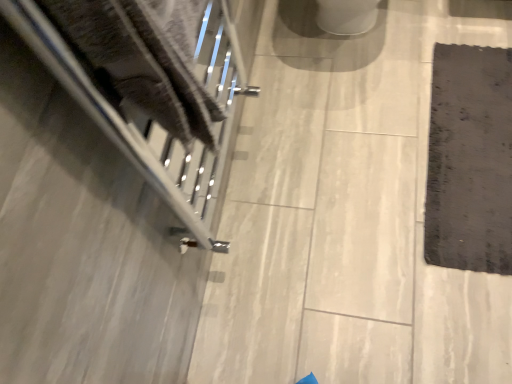
Image resolution: width=512 pixels, height=384 pixels. What do you see at coordinates (470, 160) in the screenshot? I see `dark gray textured bath mat at right` at bounding box center [470, 160].

The image size is (512, 384). In order to click on dark gray textured bath mat at right in this screenshot , I will do `click(470, 160)`.

You are a GUI agent. You are given a task and a screenshot of the screen. Output one action in this format:
    pyautogui.click(x=<x>, y=<y>)
    Task: Click on the dark gray textured bath mat at right
    The height and width of the screenshot is (384, 512).
    Given the screenshot: What is the action you would take?
    pyautogui.click(x=470, y=160)